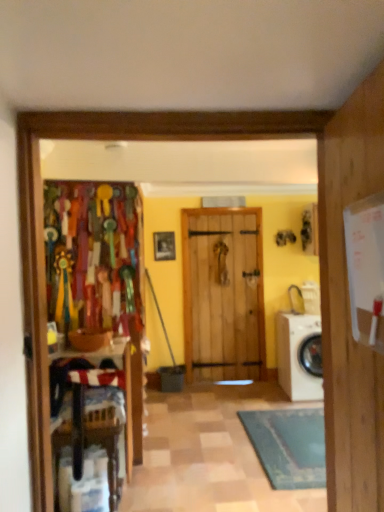
Question: From a real-world perspective, is white glossy washing machine at lower right located beneath wooden chair at left?

Choices:
 (A) no
 (B) yes

Answer: (A)

Question: From the image's perspective, does white glossy washing machine at lower right appear higher than wooden chair at left?

Choices:
 (A) no
 (B) yes

Answer: (B)

Question: Is white glossy washing machine at lower right positioned in front of wooden chair at left?

Choices:
 (A) yes
 (B) no

Answer: (B)

Question: Is white glossy washing machine at lower right facing away from wooden chair at left?

Choices:
 (A) yes
 (B) no

Answer: (B)

Question: Considering the relative positions of white glossy washing machine at lower right and wooden chair at left in the image provided, is white glossy washing machine at lower right to the left of wooden chair at left from the viewer's perspective?

Choices:
 (A) no
 (B) yes

Answer: (A)

Question: Is white glossy washing machine at lower right outside of wooden chair at left?

Choices:
 (A) yes
 (B) no

Answer: (A)

Question: Does wooden frame at center touch white glossy washing machine at lower right?

Choices:
 (A) yes
 (B) no

Answer: (B)

Question: Considering the relative sizes of wooden frame at center and white glossy washing machine at lower right in the image provided, is wooden frame at center thinner than white glossy washing machine at lower right?

Choices:
 (A) no
 (B) yes

Answer: (B)

Question: Would you say wooden frame at center is outside white glossy washing machine at lower right?

Choices:
 (A) yes
 (B) no

Answer: (A)

Question: Is wooden frame at center smaller than white glossy washing machine at lower right?

Choices:
 (A) yes
 (B) no

Answer: (A)

Question: Is wooden frame at center to the right of white glossy washing machine at lower right from the viewer's perspective?

Choices:
 (A) no
 (B) yes

Answer: (A)

Question: Is wooden frame at center not near white glossy washing machine at lower right?

Choices:
 (A) no
 (B) yes

Answer: (B)

Question: Is wooden chair at left positioned far away from white glossy washing machine at lower right?

Choices:
 (A) yes
 (B) no

Answer: (A)